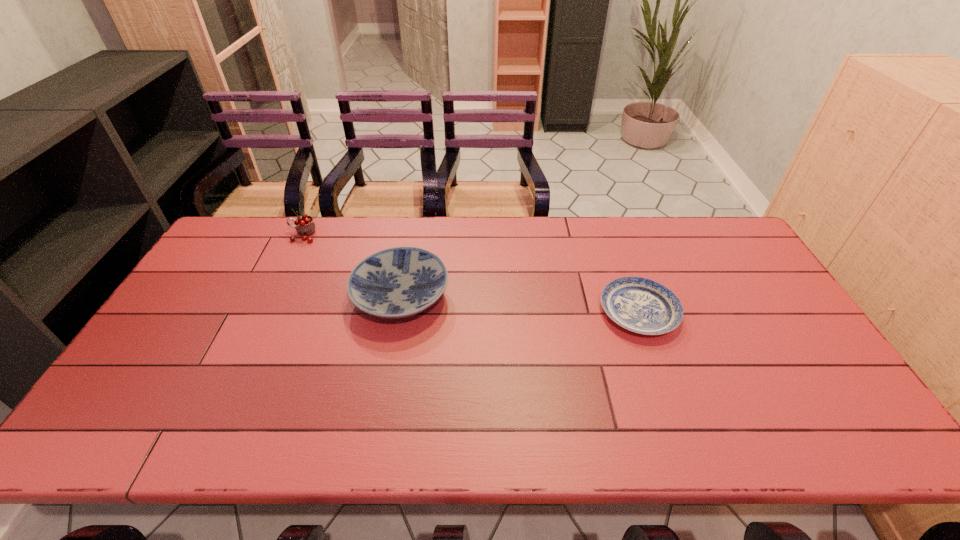
At what (x,y) coordinates should I click in order to perform the action: click on vacant area between the tallest object and the shortest object. Please return your answer as a coordinate pair (x, y). Looking at the image, I should click on (470, 273).

Where is `free space between the cherry and the second shortest object`? Image resolution: width=960 pixels, height=540 pixels. free space between the cherry and the second shortest object is located at coordinates (352, 266).

Find the location of a particular element. This screenshot has width=960, height=540. unoccupied area between the farthest object and the left plate is located at coordinates (352, 266).

The image size is (960, 540). Identify the location of empty space between the second object from left to right and the tallest object. (352, 266).

This screenshot has width=960, height=540. What are the coordinates of `free space between the farthest object and the shorter plate` in the screenshot? It's located at (470, 273).

What are the coordinates of `vacant area that lies between the taller plate and the cherry` in the screenshot? It's located at coord(352,266).

What are the coordinates of `free space between the cherry and the right plate` in the screenshot? It's located at (470, 273).

You are a GUI agent. You are given a task and a screenshot of the screen. Output one action in this format:
    pyautogui.click(x=<x>, y=<y>)
    Task: Click on the object that is the second closest to the shortest object
    Image resolution: width=960 pixels, height=540 pixels.
    Given the screenshot: What is the action you would take?
    pyautogui.click(x=305, y=226)

Select which object appears as the second closest to the rightmost object. Please provide its 2D coordinates. Your answer should be formatted as a tuple, i.e. [(x, y)], where the tuple contains the x and y coordinates of a point satisfying the conditions above.

[(305, 226)]